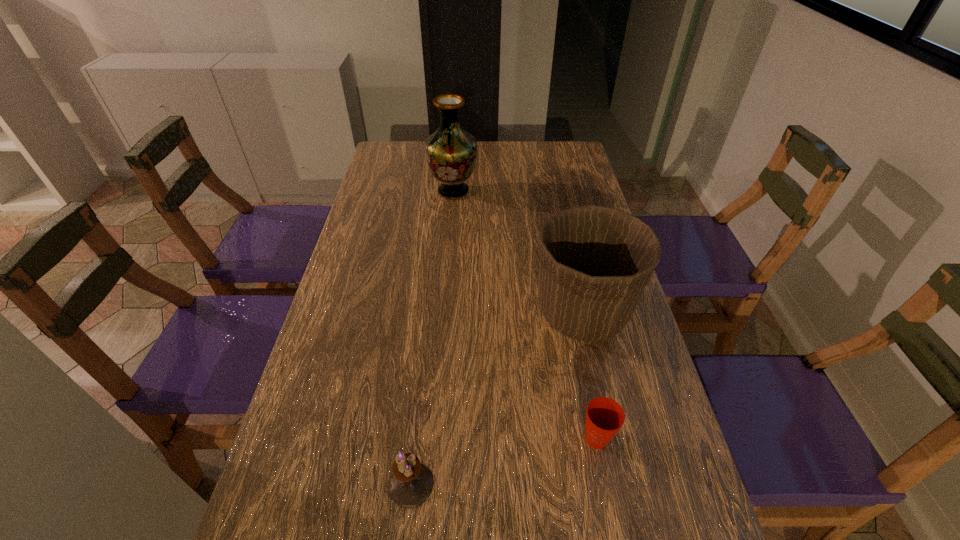
At what (x,y) coordinates should I click in order to perform the action: click on vacant space located 0.160m on the back of the nearest object. Please return your answer as a coordinate pair (x, y). Looking at the image, I should click on (421, 391).

Locate an element on the screen. vacant space located on the right of the cup is located at coordinates (662, 439).

The image size is (960, 540). Find the location of `flowerpot located in the right edge section of the desktop`. flowerpot located in the right edge section of the desktop is located at coordinates (594, 262).

You are a GUI agent. You are given a task and a screenshot of the screen. Output one action in this format:
    pyautogui.click(x=<x>, y=<y>)
    Task: Click on the cup that is positioned at the right edge
    Image resolution: width=960 pixels, height=540 pixels.
    Given the screenshot: What is the action you would take?
    pyautogui.click(x=604, y=417)

This screenshot has height=540, width=960. In the image, there is a desktop. In order to click on vacant space at the far edge in this screenshot , I will do (x=519, y=150).

This screenshot has width=960, height=540. I want to click on vacant space at the left edge of the desktop, so click(374, 200).

This screenshot has height=540, width=960. In the image, there is a desktop. In order to click on free space at the far right corner in this screenshot , I will do `click(544, 159)`.

I want to click on unoccupied area between the tallest object and the third tallest object, so click(x=432, y=338).

Where is `unoccupied area between the nearest object and the second farthest object`? unoccupied area between the nearest object and the second farthest object is located at coordinates pos(496,399).

This screenshot has height=540, width=960. What are the coordinates of `free point between the farthest object and the second tallest object` in the screenshot? It's located at (517, 253).